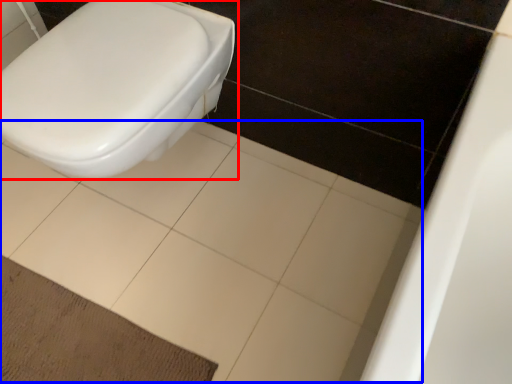
Question: Which object is closer to the camera taking this photo, toilet (highlighted by a red box) or ceramic tile (highlighted by a blue box)?

Choices:
 (A) toilet
 (B) ceramic tile

Answer: (A)